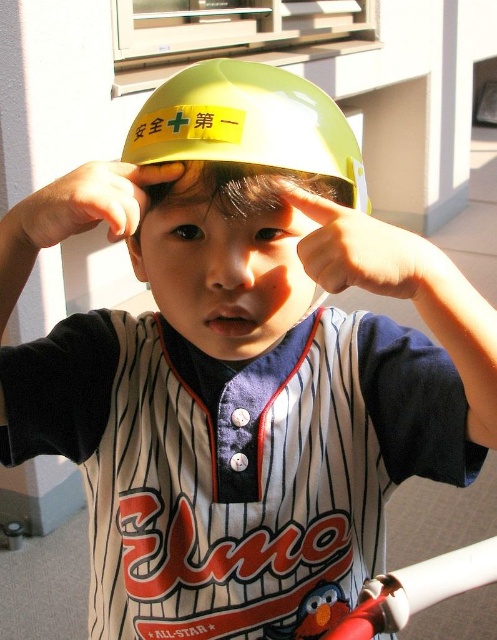
Who is more distant from viewer, (213, 83) or (167, 164)?

The point (167, 164) is more distant.

Who is more forward, (214, 93) or (97, 221)?

Point (214, 93) is in front.

What do you see at coordinates (248, 124) in the screenshot? This screenshot has width=497, height=640. I see `yellow matte helmet at center` at bounding box center [248, 124].

Identify the location of yellow matte helmet at center. (248, 124).

Who is lower down, matte yellow finger at upper center or white plastic baseball bat at lower right?

white plastic baseball bat at lower right is lower down.

Can you confirm if matte yellow finger at upper center is smaller than white plastic baseball bat at lower right?

Correct, matte yellow finger at upper center occupies less space than white plastic baseball bat at lower right.

Find the location of `matte yellow finger at upper center`. matte yellow finger at upper center is located at coordinates (82, 204).

I want to click on matte yellow finger at upper center, so click(82, 204).

Is point (335, 284) farther from camera compared to point (0, 240)?

No.

Is matte yellow finger at center behind matte yellow finger at upper center?

Yes, matte yellow finger at center is behind matte yellow finger at upper center.

The height and width of the screenshot is (640, 497). What are the coordinates of `matte yellow finger at center` in the screenshot? It's located at (366, 252).